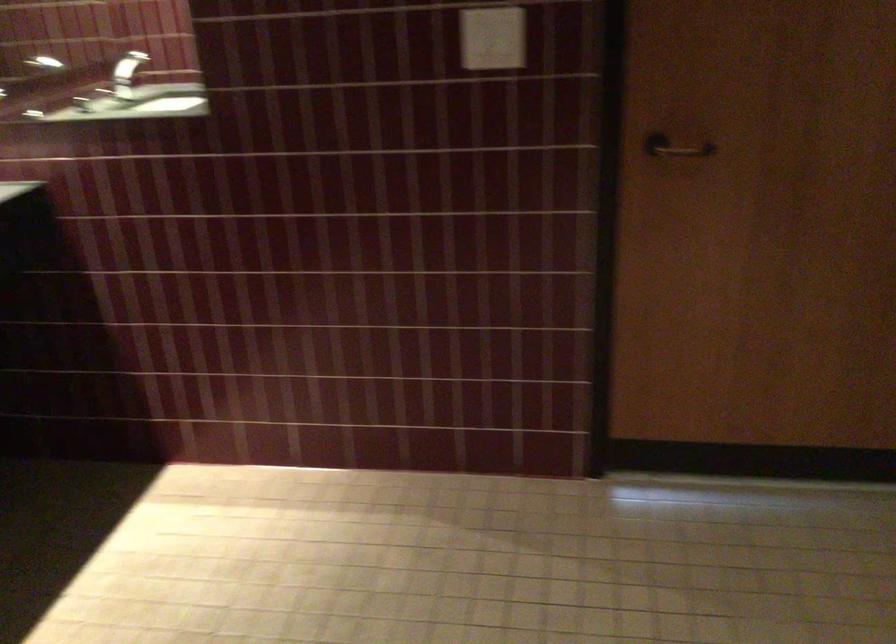
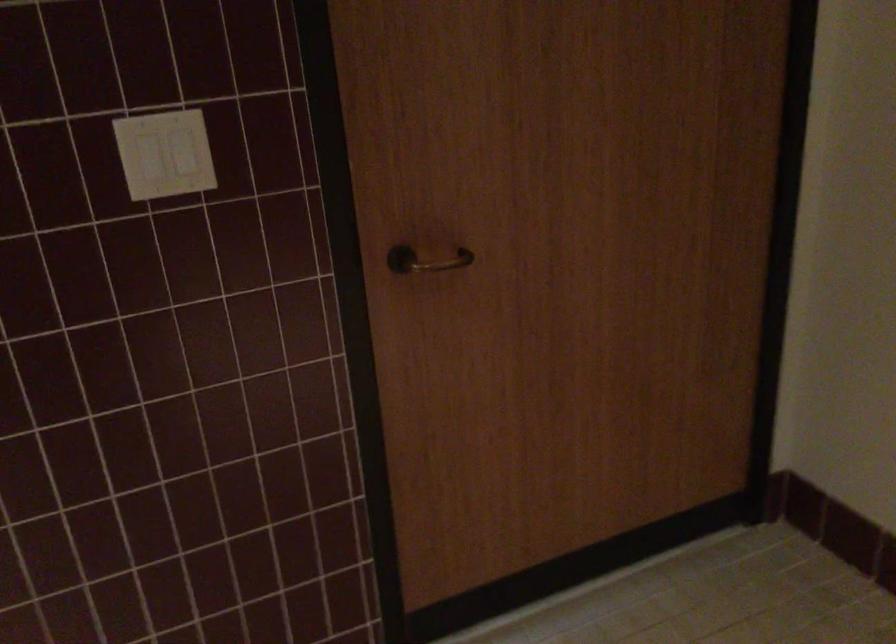
Question: The first image is from the beginning of the video and the second image is from the end. How did the camera likely rotate when shooting the video?

Choices:
 (A) Left
 (B) Right
 (C) Up
 (D) Down

Answer: (B)